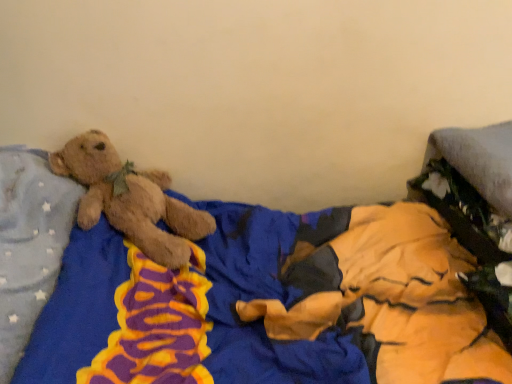
What is the approximate height of soft plush bear at left?

soft plush bear at left is 73.94 centimeters in height.

Identify the location of soft plush bear at left. (272, 304).

The height and width of the screenshot is (384, 512). Describe the element at coordinates (272, 304) in the screenshot. I see `soft plush bear at left` at that location.

Measure the distance between soft plush bear at left and camera.

The distance of soft plush bear at left from camera is 29.85 inches.

This screenshot has width=512, height=384. I want to click on soft plush bear at left, so click(272, 304).